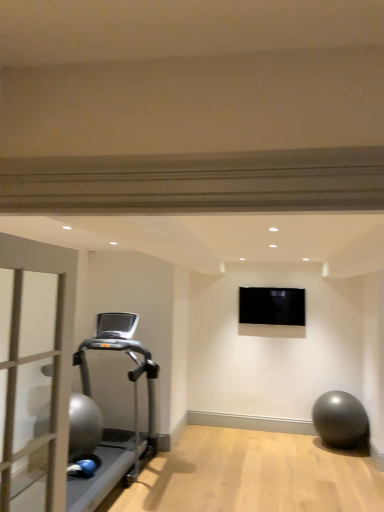
In order to face silver metallic treadmill at left, should I rotate leftwards or rightwards?

A 13.386 degree turn to the left will do.

Measure the distance between point (290,321) and camera.

Point (290,321) and camera are 17.91 feet apart.

Locate an element on the screen. The image size is (384, 512). silver metallic treadmill at left is located at coordinates (134, 408).

From a real-world perspective, is silver metallic treadmill at left physically located above or below black glossy tv at upper center?

From a real-world perspective, silver metallic treadmill at left is physically below black glossy tv at upper center.

Is silver metallic treadmill at left positioned far away from black glossy tv at upper center?

Yes.

Consider the image. Is silver metallic treadmill at left positioned beyond the bounds of black glossy tv at upper center?

Yes, silver metallic treadmill at left is located beyond the bounds of black glossy tv at upper center.

Which of these two, silver metallic treadmill at left or black glossy tv at upper center, is wider?

With larger width is silver metallic treadmill at left.

Can black glossy tv at upper center be found inside matte gray door at left?

No, black glossy tv at upper center is not a part of matte gray door at left.

Which is behind, point (4, 476) or point (257, 314)?

The point (257, 314) is behind.

Is matte gray door at left taller than black glossy tv at upper center?

Yes, matte gray door at left is taller than black glossy tv at upper center.

Is matte gray door at left facing away from black glossy tv at upper center?

matte gray door at left is not turned away from black glossy tv at upper center.

Is there a large distance between matte gray door at left and metallic gray ball at lower right?

Yes, matte gray door at left and metallic gray ball at lower right are quite far apart.

From a real-world perspective, is matte gray door at left physically above metallic gray ball at lower right?

Yes, from a real-world perspective, matte gray door at left is above metallic gray ball at lower right.

Which is correct: matte gray door at left is inside metallic gray ball at lower right, or outside of it?

The correct answer is: outside.

From the image's perspective, which one is positioned higher, matte gray door at left or metallic gray ball at lower right?

matte gray door at left appears higher in the image.

Is silver metallic treadmill at left oriented towards metallic gray ball at lower right?

Yes, silver metallic treadmill at left faces towards metallic gray ball at lower right.

Does silver metallic treadmill at left have a smaller size compared to metallic gray ball at lower right?

Incorrect, silver metallic treadmill at left is not smaller in size than metallic gray ball at lower right.

How different are the orientations of silver metallic treadmill at left and metallic gray ball at lower right in degrees?

There is a 89.7-degree angle between the facing directions of silver metallic treadmill at left and metallic gray ball at lower right.

Which of these two, matte gray door at left or silver metallic treadmill at left, stands shorter?

matte gray door at left is shorter.

Does matte gray door at left turn towards silver metallic treadmill at left?

No, matte gray door at left is not aimed at silver metallic treadmill at left.

From the image's perspective, is matte gray door at left located above or below silver metallic treadmill at left?

matte gray door at left is above silver metallic treadmill at left.

Does matte gray door at left have a larger size compared to silver metallic treadmill at left?

No.

Where is `ball below the silver metallic treadmill at left (from the image's perspective)`? The width and height of the screenshot is (384, 512). ball below the silver metallic treadmill at left (from the image's perspective) is located at coordinates (341, 420).

Is metallic gray ball at lower right not near silver metallic treadmill at left?

Yes.

Based on the photo, is metallic gray ball at lower right surrounding silver metallic treadmill at left?

No.

From a real-world perspective, is metallic gray ball at lower right located beneath silver metallic treadmill at left?

Yes, from a real-world perspective, metallic gray ball at lower right is below silver metallic treadmill at left.

From a real-world perspective, which object rests below the other?

From a 3D spatial view, silver metallic treadmill at left is below.

Is silver metallic treadmill at left thinner than matte gray door at left?

Incorrect, the width of silver metallic treadmill at left is not less than that of matte gray door at left.

How far apart are silver metallic treadmill at left and matte gray door at left?

They are 8.17 feet apart.

Image resolution: width=384 pixels, height=512 pixels. In order to click on treadmill beneath the black glossy tv at upper center (from a real-world perspective) in this screenshot , I will do `click(134, 408)`.

Locate an element on the screen. The image size is (384, 512). garage door in front of the black glossy tv at upper center is located at coordinates (38, 360).

When comparing their distances from silver metallic treadmill at left, does matte gray door at left or metallic gray ball at lower right seem further?

Based on the image, matte gray door at left appears to be further to silver metallic treadmill at left.

From the image, which object appears to be farther from silver metallic treadmill at left, matte gray door at left or black glossy tv at upper center?

Based on the image, matte gray door at left appears to be further to silver metallic treadmill at left.

Estimate the real-world distances between objects in this image. Which object is further from metallic gray ball at lower right, matte gray door at left or silver metallic treadmill at left?

matte gray door at left is positioned further to the anchor metallic gray ball at lower right.

In the scene shown: When comparing their distances from matte gray door at left, does silver metallic treadmill at left or metallic gray ball at lower right seem further?

metallic gray ball at lower right is positioned further to the anchor matte gray door at left.

Considering their positions, is metallic gray ball at lower right positioned further to black glossy tv at upper center than silver metallic treadmill at left?

The object further to black glossy tv at upper center is silver metallic treadmill at left.

Looking at the image, which one is located closer to black glossy tv at upper center, silver metallic treadmill at left or matte gray door at left?

silver metallic treadmill at left is closer to black glossy tv at upper center.

From the image, which object appears to be nearer to silver metallic treadmill at left, metallic gray ball at lower right or black glossy tv at upper center?

black glossy tv at upper center is positioned closer to the anchor silver metallic treadmill at left.

Based on their spatial positions, is metallic gray ball at lower right or matte gray door at left further from black glossy tv at upper center?

matte gray door at left is further to black glossy tv at upper center.

This screenshot has height=512, width=384. In order to click on ball between silver metallic treadmill at left and black glossy tv at upper center in the front-back direction in this screenshot , I will do `click(341, 420)`.

At what (x,y) coordinates should I click in order to perform the action: click on ball between matte gray door at left and black glossy tv at upper center in the front-back direction. Please return your answer as a coordinate pair (x, y). Looking at the image, I should click on (341, 420).

You are a GUI agent. You are given a task and a screenshot of the screen. Output one action in this format:
    pyautogui.click(x=<x>, y=<y>)
    Task: Click on the treadmill between matte gray door at left and metallic gray ball at lower right along the z-axis
    
    Given the screenshot: What is the action you would take?
    pyautogui.click(x=134, y=408)

Locate an element on the screen. The image size is (384, 512). treadmill between matte gray door at left and black glossy tv at upper center in the front-back direction is located at coordinates (134, 408).